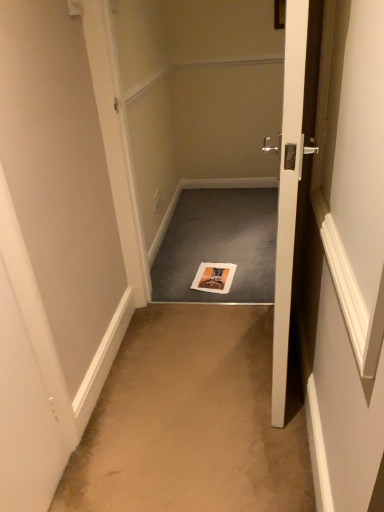
This screenshot has height=512, width=384. Identify the location of white glossy door at center. point(294,177).

Can you see orange matte magazine at center touching white glossy door at center?

orange matte magazine at center and white glossy door at center are clearly separated.

From a real-world perspective, is orange matte magazine at center located beneath white glossy door at center?

Yes, from a real-world perspective, orange matte magazine at center is below white glossy door at center.

Considering the relative sizes of orange matte magazine at center and white glossy door at center in the image provided, is orange matte magazine at center wider than white glossy door at center?

Indeed, orange matte magazine at center has a greater width compared to white glossy door at center.

Between gray carpet at center and beige carpet at center, which one has more height?

With more height is beige carpet at center.

How much distance is there between gray carpet at center and beige carpet at center?

A distance of 71.89 centimeters exists between gray carpet at center and beige carpet at center.

Does point (178, 271) come farther from viewer compared to point (146, 465)?

Yes, it is.

From a real-world perspective, between gray carpet at center and beige carpet at center, who is vertically lower?

beige carpet at center, from a real-world perspective.

Who is taller, white glossy door at center or beige carpet at center?

Standing taller between the two is white glossy door at center.

Looking at this image, measure the distance between white glossy door at center and beige carpet at center.

They are 17.35 inches apart.

Is white glossy door at center situated inside beige carpet at center or outside?

white glossy door at center lies outside beige carpet at center.

Which of these two, white glossy door at center or beige carpet at center, is bigger?

Bigger between the two is white glossy door at center.

Consider the image. From a real-world perspective, does gray carpet at center sit lower than white glossy door at center?

Indeed, from a real-world perspective, gray carpet at center is positioned beneath white glossy door at center.

Is point (224, 192) closer or farther from the camera than point (307, 17)?

Point (224, 192) appears to be farther away from the viewer than point (307, 17).

Measure the distance between gray carpet at center and white glossy door at center.

gray carpet at center is 3.90 feet away from white glossy door at center.

Can you confirm if gray carpet at center is positioned to the left of white glossy door at center?

Correct, you'll find gray carpet at center to the left of white glossy door at center.

Can you tell me how much beige carpet at center and white glossy door at center differ in facing direction?

The angle between the facing direction of beige carpet at center and the facing direction of white glossy door at center is 85.1 degrees.

Is beige carpet at center further to the viewer compared to white glossy door at center?

Yes, beige carpet at center is further from the viewer.

Who is taller, beige carpet at center or white glossy door at center?

white glossy door at center is taller.

Could gray carpet at center be considered to be inside beige carpet at center?

No, gray carpet at center is not surrounded by beige carpet at center.

Can you tell me how much beige carpet at center and gray carpet at center differ in facing direction?

The angular difference between beige carpet at center and gray carpet at center is 0.000319 degrees.

From a real-world perspective, who is located higher, beige carpet at center or gray carpet at center?

gray carpet at center is physically above.

You are a GUI agent. You are given a task and a screenshot of the screen. Output one action in this format:
    pyautogui.click(x=<x>, y=<y>)
    Task: Click on the doormat located above the beige carpet at center (from a real-world perspective)
    The width and height of the screenshot is (384, 512).
    Given the screenshot: What is the action you would take?
    pyautogui.click(x=219, y=245)

Can you confirm if gray carpet at center is taller than orange matte magazine at center?

Indeed, gray carpet at center has a greater height compared to orange matte magazine at center.

From a real-world perspective, is gray carpet at center positioned above or below orange matte magazine at center?

In terms of real-world spatial position, gray carpet at center is below orange matte magazine at center.

From the image's perspective, which is below, gray carpet at center or orange matte magazine at center?

orange matte magazine at center, from the image's perspective.

In the scene shown: Considering the sizes of gray carpet at center and orange matte magazine at center in the image, is gray carpet at center wider or thinner than orange matte magazine at center?

In the image, gray carpet at center appears to be wider than orange matte magazine at center.

In the image, there is a white glossy door at center. Identify the location of magazine below it (from the image's perspective). (214, 277).

Identify the location of corridor in front of the gray carpet at center. (192, 420).

Looking at the image, which one is located closer to white glossy door at center, beige carpet at center or gray carpet at center?

Based on the image, beige carpet at center appears to be nearer to white glossy door at center.

When comparing their distances from gray carpet at center, does beige carpet at center or orange matte magazine at center seem further?

beige carpet at center lies further to gray carpet at center than the other object.

When comparing their distances from gray carpet at center, does white glossy door at center or orange matte magazine at center seem further?

white glossy door at center is further to gray carpet at center.

Based on their spatial positions, is beige carpet at center or white glossy door at center further from orange matte magazine at center?

Based on the image, white glossy door at center appears to be further to orange matte magazine at center.

Considering their positions, is gray carpet at center positioned further to orange matte magazine at center than white glossy door at center?

white glossy door at center.

Considering their positions, is beige carpet at center positioned further to gray carpet at center than white glossy door at center?

Based on the image, white glossy door at center appears to be further to gray carpet at center.

Estimate the real-world distances between objects in this image. Which object is further from orange matte magazine at center, white glossy door at center or gray carpet at center?

Among the two, white glossy door at center is located further to orange matte magazine at center.

Considering their positions, is white glossy door at center positioned further to gray carpet at center than beige carpet at center?

white glossy door at center.

Locate an element on the screen. corridor positioned between white glossy door at center and gray carpet at center from near to far is located at coordinates (192, 420).

Where is `doormat between beige carpet at center and orange matte magazine at center along the z-axis`? doormat between beige carpet at center and orange matte magazine at center along the z-axis is located at coordinates (219, 245).

Identify the location of doormat between white glossy door at center and orange matte magazine at center from front to back. (219, 245).

The image size is (384, 512). What are the coordinates of `corridor located between white glossy door at center and orange matte magazine at center in the depth direction` in the screenshot? It's located at (192, 420).